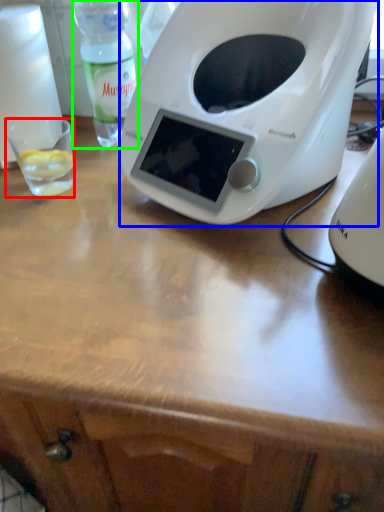
Question: Which object is the closest to the coffee cup (highlighted by a red box)? Choose among these: toaster (highlighted by a blue box) or bottle (highlighted by a green box).

Choices:
 (A) toaster
 (B) bottle

Answer: (B)